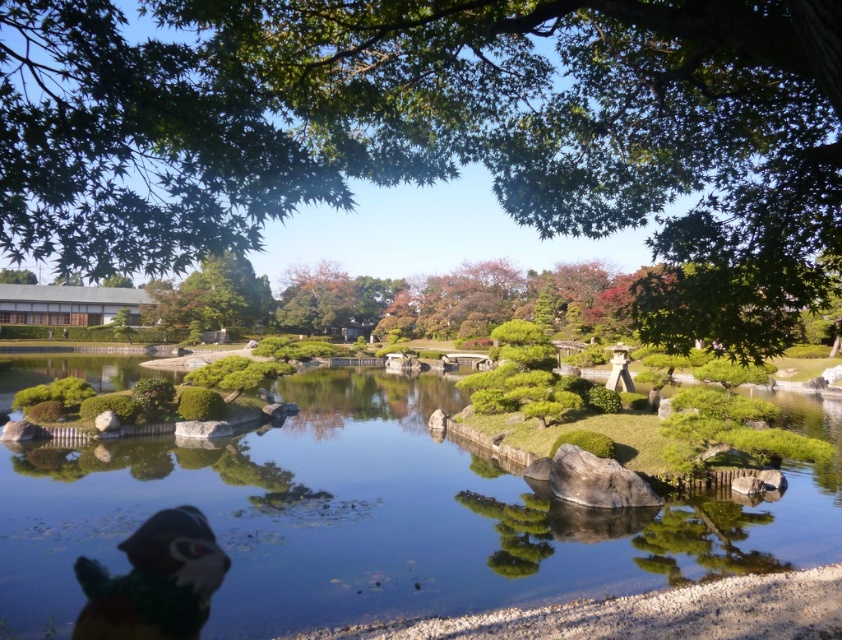
You are a gardener standing at the edge of the pond and want to place a decorative rock between the green leafy tree at upper center and the clear water at pond center. Given that the distance between them is 21.27 feet, can you estimate how many 2.5 feet wide stepping stones you would need to create a path from the tree to the water?

The distance between the green leafy tree at upper center and the clear water at pond center is 21.27 feet. Each stepping stone is 2.5 feet wide, so dividing the total distance by the width of one stone gives approximately 8.5 stones. Since you can only use whole stones, you would need 9 stepping stones to span the distance between the green leafy tree at upper center and the clear water at pond center.

You are a child who wants to reach the multicolored plush toy at lower left from the clear water at pond center without getting your feet wet. Can you do it? Please explain your reasoning.

The clear water at pond center is 4.36 meters away from the multicolored plush toy at lower left. Since the water is at the pond center and the plush toy is on the lower left, you can walk around the pond to reach the plush toy without getting your feet wet.

You are a visitor in this Japanese garden and want to take a photo of both the green leafy tree at upper center and the clear water at pond center. Which object will appear bigger in your photo?

The green leafy tree at upper center will appear bigger in the photo because it is larger in size than the clear water at pond center according to the description.